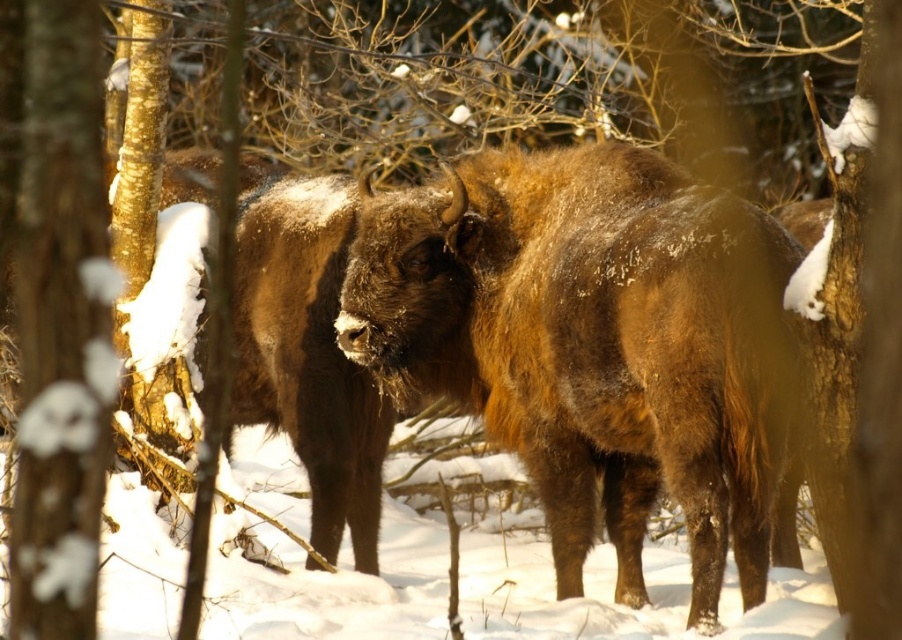
Question: Can you confirm if brown fuzzy yak at center is positioned to the right of snow-covered bark at left?

Choices:
 (A) no
 (B) yes

Answer: (B)

Question: Which object appears closest to the camera in this image?

Choices:
 (A) snow-covered bark at left
 (B) brown fuzzy yak at center

Answer: (A)

Question: Does brown fuzzy yak at center have a smaller size compared to snow-covered bark at left?

Choices:
 (A) yes
 (B) no

Answer: (B)

Question: Is brown fuzzy yak at center thinner than snow-covered bark at left?

Choices:
 (A) yes
 (B) no

Answer: (B)

Question: Which point is farther to the camera?

Choices:
 (A) (456, 268)
 (B) (109, 348)

Answer: (A)

Question: Which point is farther to the camera?

Choices:
 (A) snow-covered bark at left
 (B) brown fuzzy yak at center

Answer: (B)